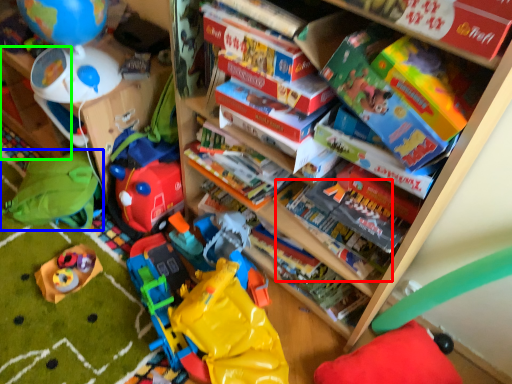
Question: Based on their relative distances, which object is farther from book (highlighted by a red box)? Choose from toy (highlighted by a blue box) and shelf (highlighted by a green box).

Choices:
 (A) toy
 (B) shelf

Answer: (B)